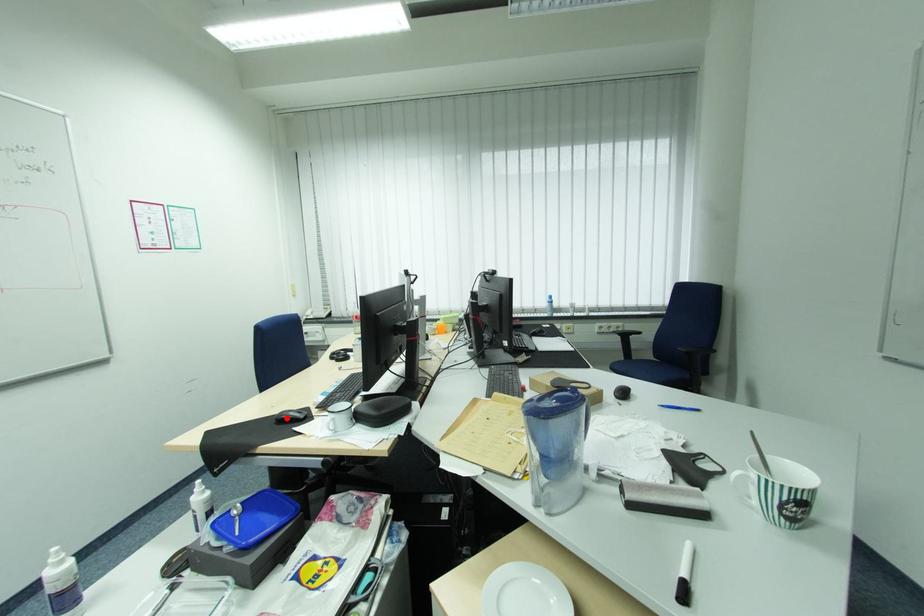
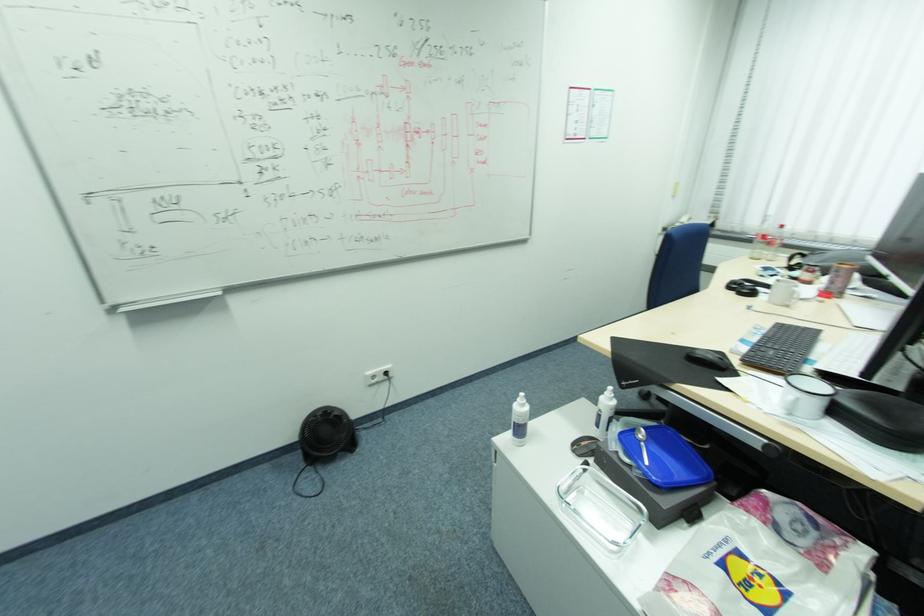
Find the pixel in the second image that matches the highlighted location in the first image.

(699, 355)